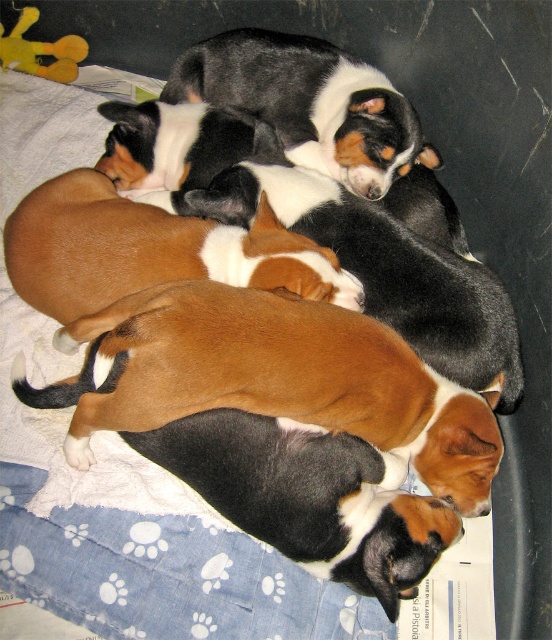
Does brown and white fur at center appear over brown fur at center?

Actually, brown and white fur at center is below brown fur at center.

Is point (428, 435) positioned before point (290, 236)?

Yes, point (428, 435) is in front of point (290, 236).

Between point (251, 342) and point (50, 296), which one is positioned behind?

Positioned behind is point (50, 296).

You are a GUI agent. You are given a task and a screenshot of the screen. Output one action in this format:
    pyautogui.click(x=<x>, y=<y>)
    Task: Click on the brown and white fur at center
    
    Given the screenshot: What is the action you would take?
    pyautogui.click(x=288, y=380)

Does tri-color fur sleeping puppies at center have a lesser width compared to yellow plush toy at upper left?

No.

What do you see at coordinates (309, 104) in the screenshot?
I see `tri-color fur sleeping puppies at center` at bounding box center [309, 104].

I want to click on tri-color fur sleeping puppies at center, so click(309, 104).

Which is below, brown and white fur at center or tri-color fur sleeping puppies at center?

brown and white fur at center is below.

Looking at this image, between brown and white fur at center and tri-color fur sleeping puppies at center, which one has more height?

With more height is brown and white fur at center.

Who is more distant from viewer, (395,381) or (420,152)?

Point (420,152)

The width and height of the screenshot is (552, 640). Identify the location of brown and white fur at center. (288, 380).